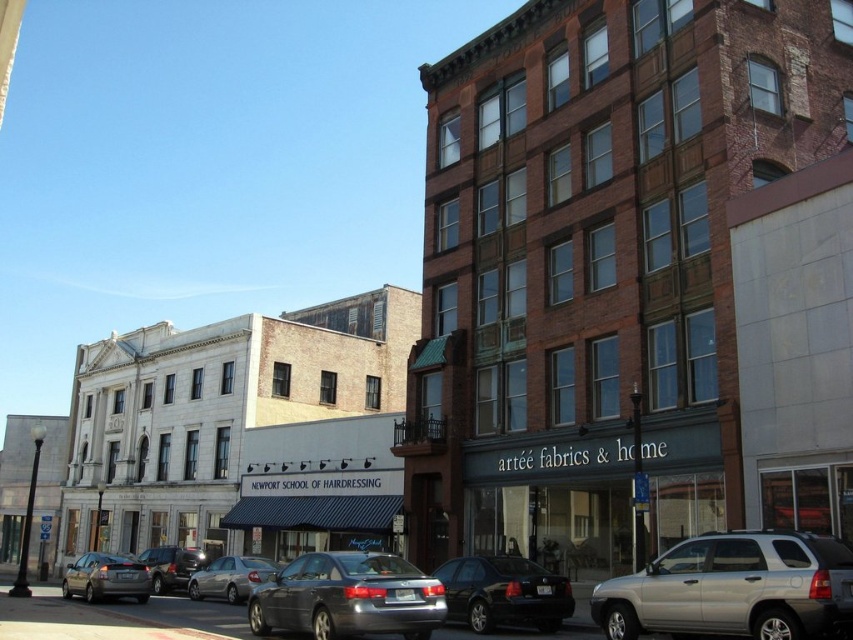
Consider the image. You are a delivery driver who needs to park your silver metallic suv at lower right in this street scene. The parking spot is located at coordinate point 0.850, 0.850. Will your vehicle fit into the parking spot?

The silver metallic suv at lower right is located at point (733, 588), which is slightly to the right and above the parking spot at (724, 544). Therefore, the vehicle may not fit properly into the designated parking spot.

You are a delivery driver who needs to park your vehicle between the silver metallic sedan at center and the shiny silver sedan at lower left. The parking spot you want to use requires a minimum of 20 feet of space. Based on the scene, will there be enough space for your vehicle?

The distance between the silver metallic sedan at center and the shiny silver sedan at lower left is 19.42 feet, which is slightly less than the required 20 feet. Therefore, there is not enough space to park your vehicle in that spot.

You are standing on the street looking at the red brick building with the art store. There are two points marked on the building. One is at coordinate point (207, 595) and the other is at point (177, 548). Which of these two points is closer to you?

Point (207, 595) is closer to the viewer than point (177, 548).